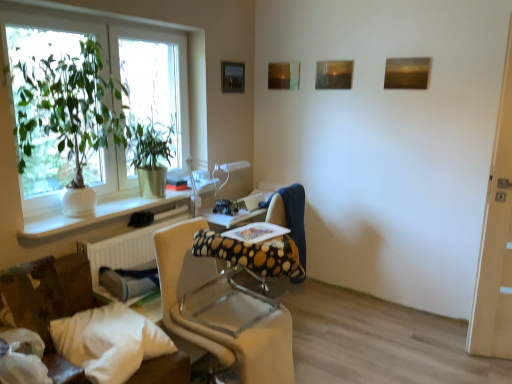
Question: Does beige fabric chair at center have a lesser height compared to green glossy plant at left, the 2th houseplant from the front?

Choices:
 (A) yes
 (B) no

Answer: (B)

Question: From the image's perspective, is beige fabric chair at center beneath green glossy plant at left, the 2th houseplant from the front?

Choices:
 (A) yes
 (B) no

Answer: (A)

Question: From a real-world perspective, is beige fabric chair at center on green glossy plant at left, positioned as the 1th houseplant in back-to-front order?

Choices:
 (A) yes
 (B) no

Answer: (B)

Question: Does beige fabric chair at center appear on the right side of green glossy plant at left, positioned as the 1th houseplant in back-to-front order?

Choices:
 (A) yes
 (B) no

Answer: (A)

Question: Is beige fabric chair at center further to camera compared to green glossy plant at left, positioned as the 1th houseplant in back-to-front order?

Choices:
 (A) no
 (B) yes

Answer: (A)

Question: From a real-world perspective, is green glossy plant at left, the 2th houseplant from the front, positioned above or below polka dot fabric swivel chair at center?

Choices:
 (A) above
 (B) below

Answer: (A)

Question: In terms of width, does green glossy plant at left, the 2th houseplant from the front, look wider or thinner when compared to polka dot fabric swivel chair at center?

Choices:
 (A) thin
 (B) wide

Answer: (A)

Question: Would you say green glossy plant at left, positioned as the 1th houseplant in back-to-front order, is inside or outside polka dot fabric swivel chair at center?

Choices:
 (A) inside
 (B) outside

Answer: (B)

Question: Considering the positions of green glossy plant at left, positioned as the 1th houseplant in back-to-front order, and polka dot fabric swivel chair at center in the image, is green glossy plant at left, positioned as the 1th houseplant in back-to-front order, bigger or smaller than polka dot fabric swivel chair at center?

Choices:
 (A) small
 (B) big

Answer: (A)

Question: From the image's perspective, is white textured radiator at lower left above or below white fabric pillow at lower left?

Choices:
 (A) above
 (B) below

Answer: (A)

Question: Is white textured radiator at lower left inside the boundaries of white fabric pillow at lower left, or outside?

Choices:
 (A) inside
 (B) outside

Answer: (B)

Question: Considering the positions of white textured radiator at lower left and white fabric pillow at lower left in the image, is white textured radiator at lower left wider or thinner than white fabric pillow at lower left?

Choices:
 (A) wide
 (B) thin

Answer: (B)

Question: Is white textured radiator at lower left to the left or to the right of white fabric pillow at lower left in the image?

Choices:
 (A) right
 (B) left

Answer: (B)

Question: In the image, is white textured radiator at lower left positioned in front of or behind matte wooden picture frame at upper center, the third picture frame viewed from the right?

Choices:
 (A) behind
 (B) front

Answer: (B)

Question: Considering the positions of white textured radiator at lower left and matte wooden picture frame at upper center, which is the 2th picture frame in left-to-right order, in the image, is white textured radiator at lower left bigger or smaller than matte wooden picture frame at upper center, which is the 2th picture frame in left-to-right order,?

Choices:
 (A) big
 (B) small

Answer: (A)